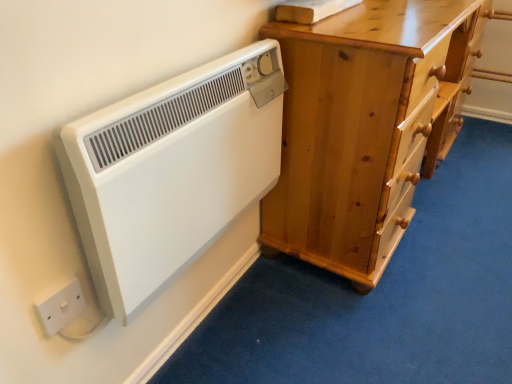
Where is `white plastic radiator at left`? The image size is (512, 384). white plastic radiator at left is located at coordinates (170, 170).

Are white plastic electric outlet at lower left and white plastic radiator at left located far from each other?

That's not correct — white plastic electric outlet at lower left is a little close to white plastic radiator at left.

This screenshot has width=512, height=384. I want to click on home appliance positioned vertically above the white plastic electric outlet at lower left (from a real-world perspective), so click(170, 170).

Is white plastic electric outlet at lower left wider than white plastic radiator at left?

Incorrect, the width of white plastic electric outlet at lower left does not surpass that of white plastic radiator at left.

Who is more distant, white plastic electric outlet at lower left or white plastic radiator at left?

white plastic electric outlet at lower left is more distant.

From the image's perspective, which is below, white plastic electric outlet at lower left or light brown wooden chest of drawers at right?

From the image's view, white plastic electric outlet at lower left is below.

Between white plastic electric outlet at lower left and light brown wooden chest of drawers at right, which one has smaller width?

With smaller width is white plastic electric outlet at lower left.

Which of these two, white plastic electric outlet at lower left or light brown wooden chest of drawers at right, stands taller?

Standing taller between the two is light brown wooden chest of drawers at right.

Is white plastic electric outlet at lower left next to light brown wooden chest of drawers at right and touching it?

No.

Is white plastic radiator at left next to light brown wooden chest of drawers at right?

No, white plastic radiator at left is not in contact with light brown wooden chest of drawers at right.

How distant is white plastic radiator at left from light brown wooden chest of drawers at right?

They are 14.54 inches apart.

Is white plastic radiator at left oriented towards light brown wooden chest of drawers at right?

No, white plastic radiator at left is not oriented towards light brown wooden chest of drawers at right.

From the image's perspective, is white plastic radiator at left located above or below light brown wooden chest of drawers at right?

white plastic radiator at left is below light brown wooden chest of drawers at right.

Looking at the image, does light brown wooden chest of drawers at right seem bigger or smaller compared to white plastic electric outlet at lower left?

Considering their sizes, light brown wooden chest of drawers at right takes up more space than white plastic electric outlet at lower left.

From the image's perspective, is light brown wooden chest of drawers at right located above or below white plastic electric outlet at lower left?

Based on their image positions, light brown wooden chest of drawers at right is located above white plastic electric outlet at lower left.

Is light brown wooden chest of drawers at right completely or partially outside of white plastic electric outlet at lower left?

Yes.

Is white plastic electric outlet at lower left at the back of light brown wooden chest of drawers at right?

No, light brown wooden chest of drawers at right's orientation is not away from white plastic electric outlet at lower left.

How distant is white plastic radiator at left from white plastic electric outlet at lower left?

A distance of 11.96 inches exists between white plastic radiator at left and white plastic electric outlet at lower left.

Consider the image. Does white plastic radiator at left come in front of white plastic electric outlet at lower left?

Yes, it is in front of white plastic electric outlet at lower left.

From a real-world perspective, between white plastic radiator at left and white plastic electric outlet at lower left, who is vertically higher?

white plastic radiator at left is physically above.

Would you consider white plastic radiator at left to be distant from white plastic electric outlet at lower left?

No, white plastic radiator at left is in close proximity to white plastic electric outlet at lower left.

Which object is closer to the camera taking this photo, light brown wooden chest of drawers at right or white plastic radiator at left?

white plastic radiator at left is in front.

Locate an element on the screen. home appliance that is in front of the light brown wooden chest of drawers at right is located at coordinates pos(170,170).

How many degrees apart are the facing directions of light brown wooden chest of drawers at right and white plastic radiator at left?

There is a 2.94-degree angle between the facing directions of light brown wooden chest of drawers at right and white plastic radiator at left.

From the image's perspective, is light brown wooden chest of drawers at right below white plastic radiator at left?

Incorrect, from the image's perspective, light brown wooden chest of drawers at right is higher than white plastic radiator at left.

Identify the location of electric outlet on the left of white plastic radiator at left. This screenshot has width=512, height=384. (59, 305).

This screenshot has height=384, width=512. Identify the location of electric outlet lying in front of the light brown wooden chest of drawers at right. (59, 305).

When comparing their distances from white plastic radiator at left, does white plastic electric outlet at lower left or light brown wooden chest of drawers at right seem further?

The object further to white plastic radiator at left is light brown wooden chest of drawers at right.

Which object lies further to the anchor point light brown wooden chest of drawers at right, white plastic radiator at left or white plastic electric outlet at lower left?

Based on the image, white plastic electric outlet at lower left appears to be further to light brown wooden chest of drawers at right.

Looking at this image, looking at the image, which one is located further to white plastic electric outlet at lower left, white plastic radiator at left or light brown wooden chest of drawers at right?

The object further to white plastic electric outlet at lower left is light brown wooden chest of drawers at right.

Which object lies further to the anchor point white plastic radiator at left, light brown wooden chest of drawers at right or white plastic electric outlet at lower left?

The object further to white plastic radiator at left is light brown wooden chest of drawers at right.

Considering their positions, is light brown wooden chest of drawers at right positioned further to white plastic electric outlet at lower left than white plastic radiator at left?

Among the two, light brown wooden chest of drawers at right is located further to white plastic electric outlet at lower left.

Looking at this image, which object lies nearer to the anchor point light brown wooden chest of drawers at right, white plastic electric outlet at lower left or white plastic radiator at left?

The object closer to light brown wooden chest of drawers at right is white plastic radiator at left.

Locate an element on the screen. home appliance between white plastic electric outlet at lower left and light brown wooden chest of drawers at right in the horizontal direction is located at coordinates (170, 170).